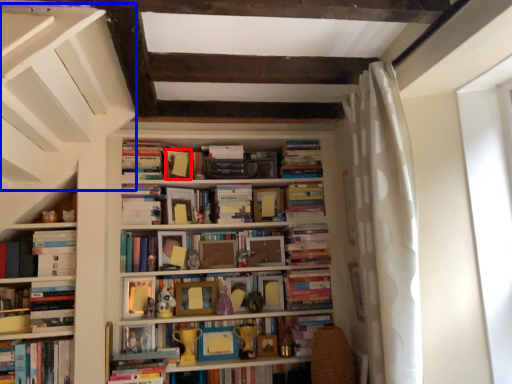
Question: Which object appears closest to the camera in this image, paperback book (highlighted by a red box) or stairwell (highlighted by a blue box)?

Choices:
 (A) paperback book
 (B) stairwell

Answer: (B)